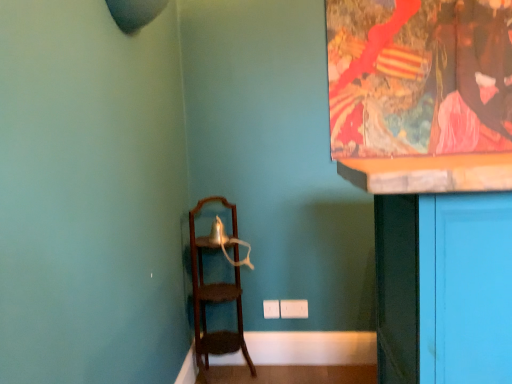
This screenshot has height=384, width=512. Find the location of `wooden ladder at left`. wooden ladder at left is located at coordinates (215, 293).

In order to face wooden ladder at left, should I rotate leftwards or rightwards?

It's best to rotate left around 4.320 degrees.

What do you see at coordinates (215, 293) in the screenshot? Image resolution: width=512 pixels, height=384 pixels. I see `wooden ladder at left` at bounding box center [215, 293].

Locate an element on the screen. The width and height of the screenshot is (512, 384). wooden frame at upper right is located at coordinates (421, 94).

The width and height of the screenshot is (512, 384). What do you see at coordinates (421, 94) in the screenshot?
I see `wooden frame at upper right` at bounding box center [421, 94].

Locate an element on the screen. wooden ladder at left is located at coordinates (215, 293).

Is wooden frame at upper right at the left side of wooden ladder at left?

No.

Between wooden frame at upper right and wooden ladder at left, which one is positioned behind?

wooden frame at upper right is more distant.

Which is closer, [492,14] or [201,255]?

Positioned in front is point [492,14].

From the image's perspective, which one is positioned higher, wooden frame at upper right or wooden ladder at left?

From the image's view, wooden frame at upper right is above.

From a real-world perspective, between wooden frame at upper right and wooden ladder at left, who is vertically lower?

In real-world perspective, wooden ladder at left is lower.

Between wooden frame at upper right and wooden ladder at left, which one has larger width?

wooden ladder at left.

Considering the relative sizes of wooden frame at upper right and wooden ladder at left in the image provided, is wooden frame at upper right taller than wooden ladder at left?

No.

Is wooden frame at upper right bigger or smaller than wooden ladder at left?

Considering their sizes, wooden frame at upper right takes up less space than wooden ladder at left.

Would you say wooden frame at upper right is inside or outside wooden ladder at left?

wooden frame at upper right cannot be found inside wooden ladder at left.

Is there a large distance between wooden frame at upper right and wooden ladder at left?

Absolutely, wooden frame at upper right is distant from wooden ladder at left.

Is wooden frame at upper right oriented away from wooden ladder at left?

No, wooden frame at upper right is not facing the opposite direction of wooden ladder at left.

Based on the photo, what's the angular difference between wooden frame at upper right and wooden ladder at left's facing directions?

The angle between the facing direction of wooden frame at upper right and the facing direction of wooden ladder at left is 91.1 degrees.

At what (x,y) coordinates should I click in order to perform the action: click on picture frame on the right of the wooden ladder at left. Please return your answer as a coordinate pair (x, y). Looking at the image, I should click on (421, 94).

Considering the relative positions of wooden ladder at left and wooden frame at upper right in the image provided, is wooden ladder at left to the left or to the right of wooden frame at upper right?

wooden ladder at left is to the left of wooden frame at upper right.

In the scene shown: Is wooden ladder at left closer to the viewer compared to wooden frame at upper right?

Yes, wooden ladder at left is in front of wooden frame at upper right.

Which point is more distant from viewer, (234, 235) or (378, 88)?

Point (234, 235)

From the image's perspective, which object appears higher, wooden ladder at left or wooden frame at upper right?

wooden frame at upper right is shown above in the image.

From a real-world perspective, which is physically above, wooden ladder at left or wooden frame at upper right?

wooden frame at upper right is physically above.

Considering the sizes of objects wooden ladder at left and wooden frame at upper right in the image provided, who is thinner, wooden ladder at left or wooden frame at upper right?

wooden frame at upper right is thinner.

Is wooden ladder at left taller than wooden frame at upper right?

Yes, wooden ladder at left is taller than wooden frame at upper right.

Which of these two, wooden ladder at left or wooden frame at upper right, is bigger?

With larger size is wooden ladder at left.

Choose the correct answer: Is wooden ladder at left inside wooden frame at upper right or outside it?

wooden ladder at left is located beyond the bounds of wooden frame at upper right.

Is the surface of wooden ladder at left in direct contact with wooden frame at upper right?

wooden ladder at left is not next to wooden frame at upper right, and they're not touching.

Does wooden ladder at left turn towards wooden frame at upper right?

No, wooden ladder at left is not turned towards wooden frame at upper right.

What's the angular difference between wooden ladder at left and wooden frame at upper right's facing directions?

wooden ladder at left and wooden frame at upper right are facing 91.1 degrees away from each other.

This screenshot has height=384, width=512. I want to click on furniture that appears below the wooden frame at upper right (from the image's perspective), so click(x=215, y=293).

The width and height of the screenshot is (512, 384). Identify the location of picture frame above the wooden ladder at left (from a real-world perspective). (421, 94).

Find the location of a particular element. furniture on the left of wooden frame at upper right is located at coordinates (215, 293).